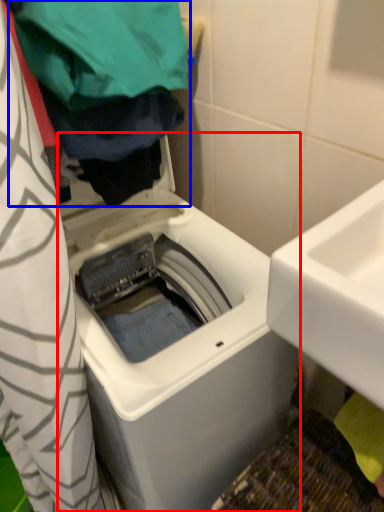
Question: Which object is closer to the camera taking this photo, washing machine (highlighted by a red box) or clothing (highlighted by a blue box)?

Choices:
 (A) washing machine
 (B) clothing

Answer: (B)